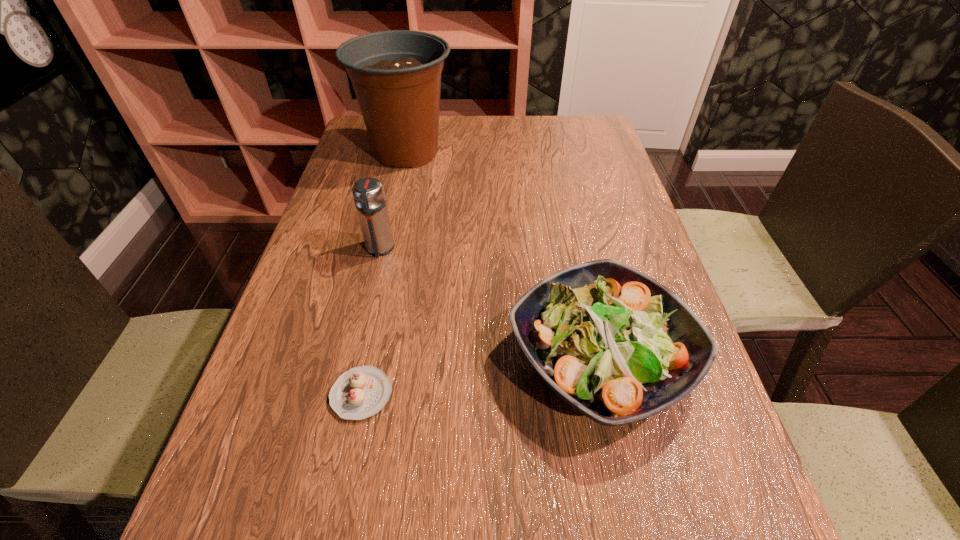
Identify the location of vacant space that's between the third tallest object and the third nearest object. (490, 305).

Locate an element on the screen. free space that is in between the tallest object and the rightmost object is located at coordinates (503, 256).

This screenshot has width=960, height=540. What are the coordinates of `object that stands as the third closest to the second tallest object` in the screenshot? It's located at (361, 392).

You are a GUI agent. You are given a task and a screenshot of the screen. Output one action in this format:
    pyautogui.click(x=<x>, y=<y>)
    Task: Click on the object that is the closest to the thermos bottle
    
    Given the screenshot: What is the action you would take?
    pyautogui.click(x=396, y=75)

The height and width of the screenshot is (540, 960). In order to click on vacant space that satisfies the following two spatial constraints: 1. on the front side of the rightmost object; 2. on the right side of the flowerpot in this screenshot , I will do `click(361, 360)`.

This screenshot has height=540, width=960. Find the location of `free space that satisfies the following two spatial constraints: 1. with a handle on the side of the second tallest object; 2. on the left side of the third tallest object`. free space that satisfies the following two spatial constraints: 1. with a handle on the side of the second tallest object; 2. on the left side of the third tallest object is located at coordinates (353, 360).

Locate an element on the screen. This screenshot has height=540, width=960. vacant space that satisfies the following two spatial constraints: 1. on the front side of the shortest object; 2. on the left side of the farthest object is located at coordinates (353, 394).

Identify the location of vacant space that satisfies the following two spatial constraints: 1. with a handle on the side of the thermos bottle; 2. on the left side of the cupcake. (346, 394).

Find the location of a particular element. free spot that satisfies the following two spatial constraints: 1. on the front side of the second shortest object; 2. on the left side of the flowerpot is located at coordinates (361, 360).

The width and height of the screenshot is (960, 540). I want to click on vacant region that satisfies the following two spatial constraints: 1. on the front side of the farthest object; 2. on the left side of the shortest object, so click(353, 394).